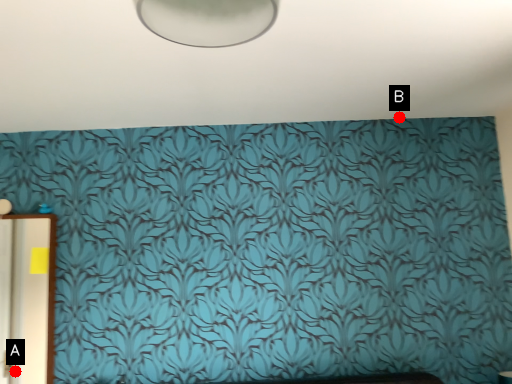
Question: Two points are circled on the image, labeled by A and B beside each circle. Which of the following is the closest to the observer?

Choices:
 (A) A is closer
 (B) B is closer

Answer: (B)